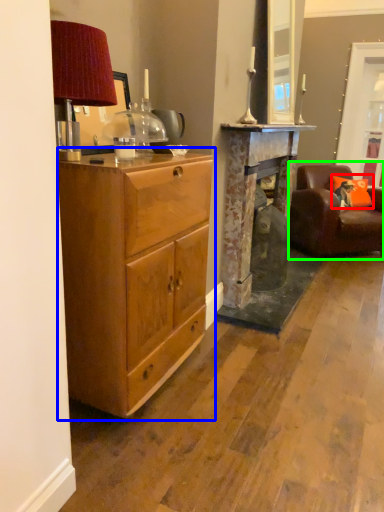
Question: Which object is the closest to the pillow (highlighted by a red box)? Choose among these: cabinetry (highlighted by a blue box) or chair (highlighted by a green box).

Choices:
 (A) cabinetry
 (B) chair

Answer: (B)